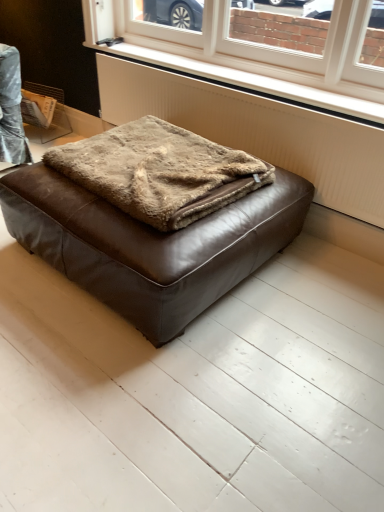
This screenshot has height=512, width=384. I want to click on free point above white textured radiator at lower center (from a real-world perspective), so click(x=251, y=71).